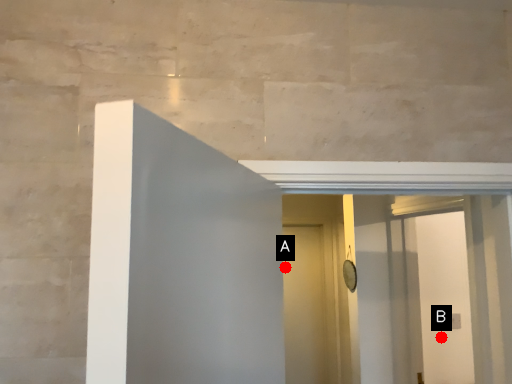
Question: Two points are circled on the image, labeled by A and B beside each circle. Which point is farther to the camera?

Choices:
 (A) A is further
 (B) B is further

Answer: (A)